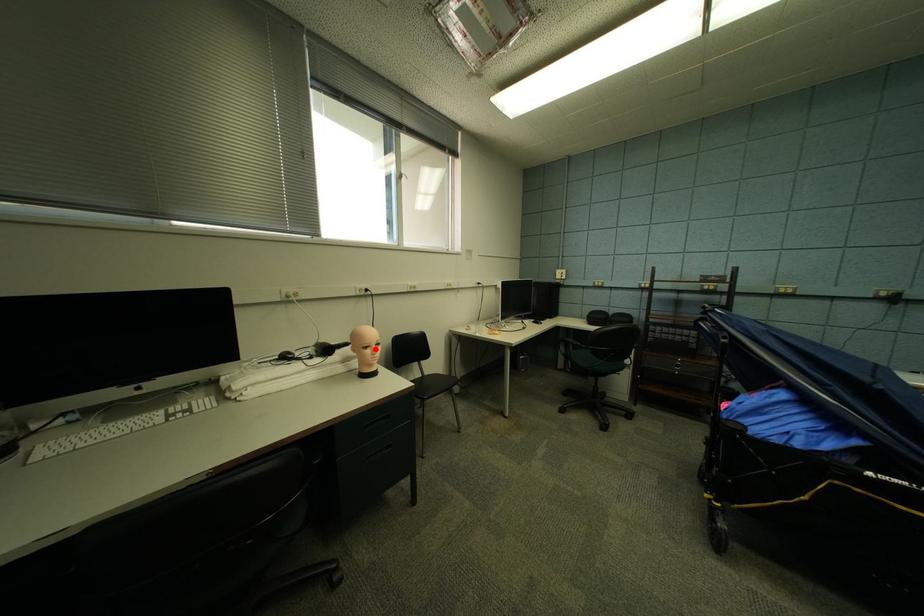
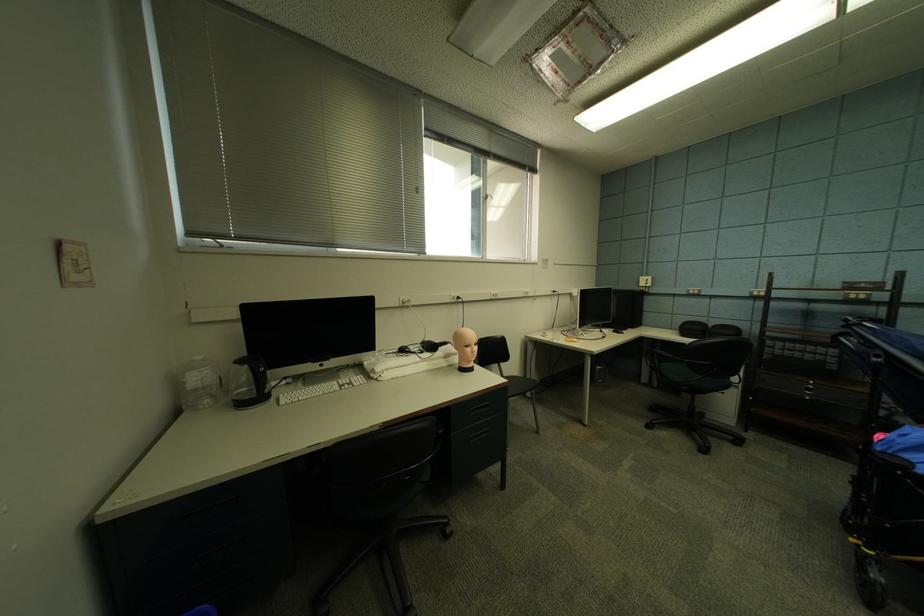
Where in the second image is the point corresponding to the highlighted location from the first image?

(477, 347)